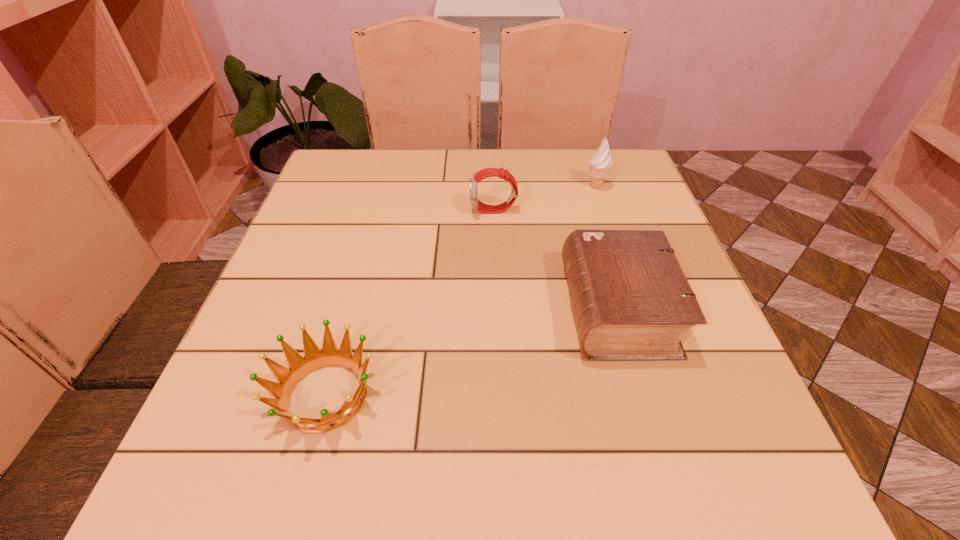
At what (x,y) coordinates should I click in order to perform the action: click on icecream that is at the right edge. Please return your answer as a coordinate pair (x, y). Looking at the image, I should click on (600, 163).

The width and height of the screenshot is (960, 540). I want to click on Bible located at the right edge, so click(631, 300).

Locate an element on the screen. This screenshot has width=960, height=540. object that is positioned at the near left corner is located at coordinates (299, 367).

At what (x,y) coordinates should I click in order to perform the action: click on object present at the far right corner. Please return your answer as a coordinate pair (x, y). This screenshot has width=960, height=540. Looking at the image, I should click on (x=600, y=163).

In the image, there is a desktop. Where is `vacant space at the far edge`? The width and height of the screenshot is (960, 540). vacant space at the far edge is located at coordinates (444, 166).

In the image, there is a desktop. At what (x,y) coordinates should I click in order to perform the action: click on vacant space at the near edge. Please return your answer as a coordinate pair (x, y). Looking at the image, I should click on (573, 504).

In the image, there is a desktop. Identify the location of vacant space at the left edge. (265, 293).

You are a GUI agent. You are given a task and a screenshot of the screen. Output one action in this format:
    pyautogui.click(x=<x>, y=<y>)
    Task: Click on the vacant space at the right edge of the desktop
    Image resolution: width=960 pixels, height=540 pixels.
    Given the screenshot: What is the action you would take?
    pyautogui.click(x=622, y=222)

This screenshot has width=960, height=540. In order to click on vacant space at the far left corner of the desktop in this screenshot , I will do `click(324, 182)`.

The image size is (960, 540). I want to click on free space at the near right corner of the desktop, so click(x=789, y=489).